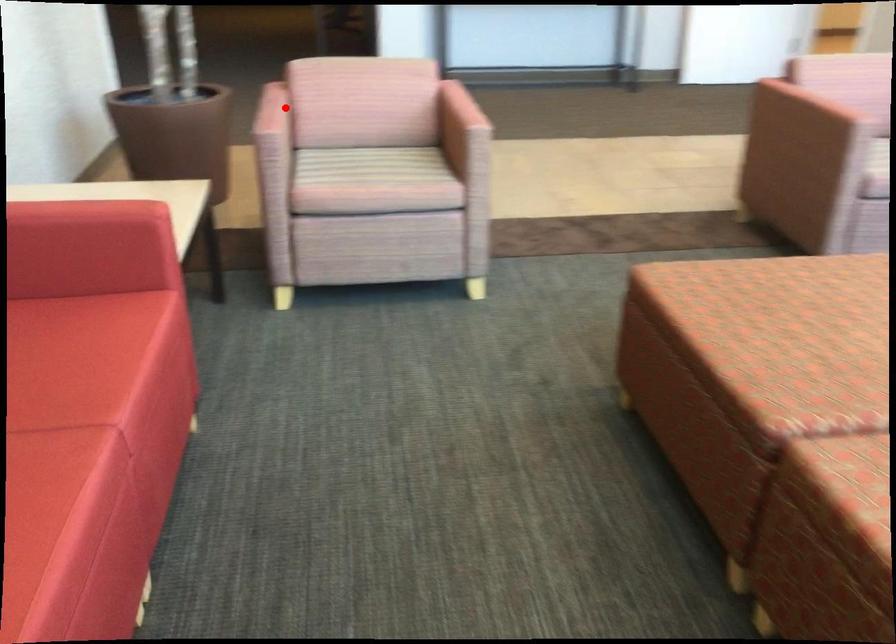
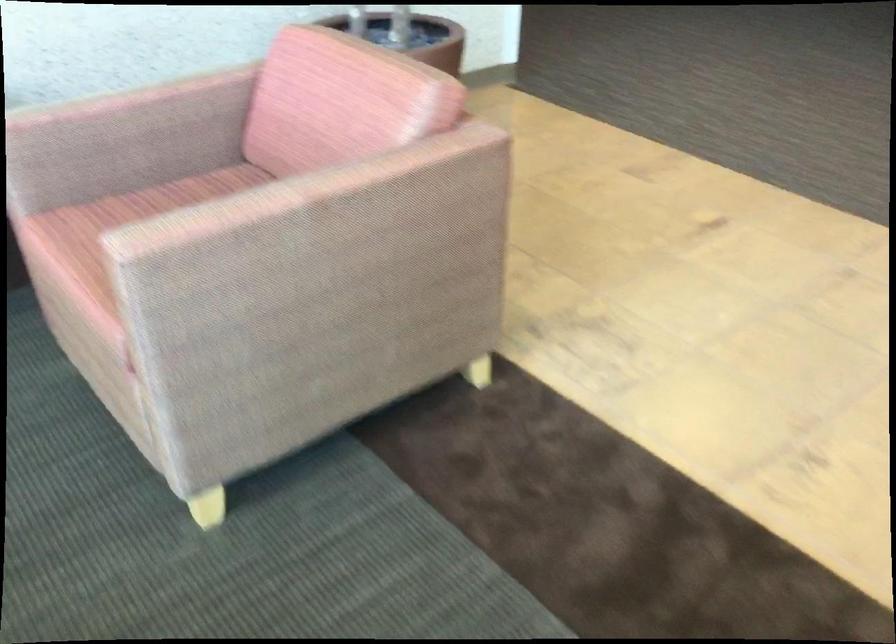
In the second image, find the point that corresponds to the highlighted location in the first image.

(121, 98)